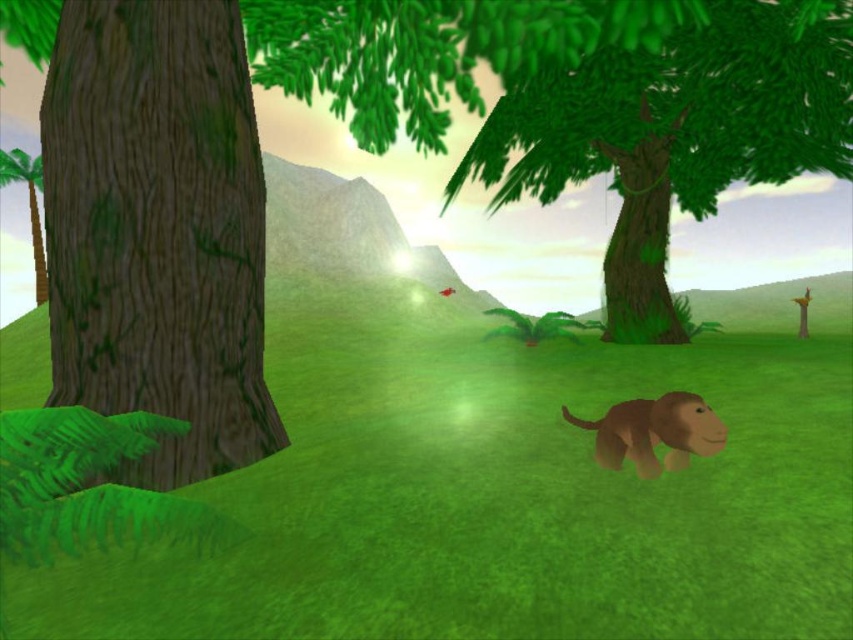
You are a character in this game who needs to cross from the left side to the right side of the screen. There are two obstacles in your path. The first is the green grass at center, and the second is the green matte tree at upper center. Which obstacle will you encounter first as you move from left to right?

You will encounter the green grass at center first because it is located closer to the left side compared to the green matte tree at upper center, which is positioned further to the right.

You are a character in the game who needs to reach the green matte tree at upper center. You see the brown matte monkey at center blocking your path. Can you go around the monkey to reach the tree?

The green matte tree at upper center is positioned on the right side of the brown matte monkey at center, so you can go around the monkey to the right to reach the tree.

You are an explorer in this scene and want to climb the green matte tree at upper center to get a better view. However, you need to avoid the brown matte monkey at center. Is the monkey below or above the tree?

The green matte tree at upper center is above the brown matte monkey at center, so the monkey is below the tree.